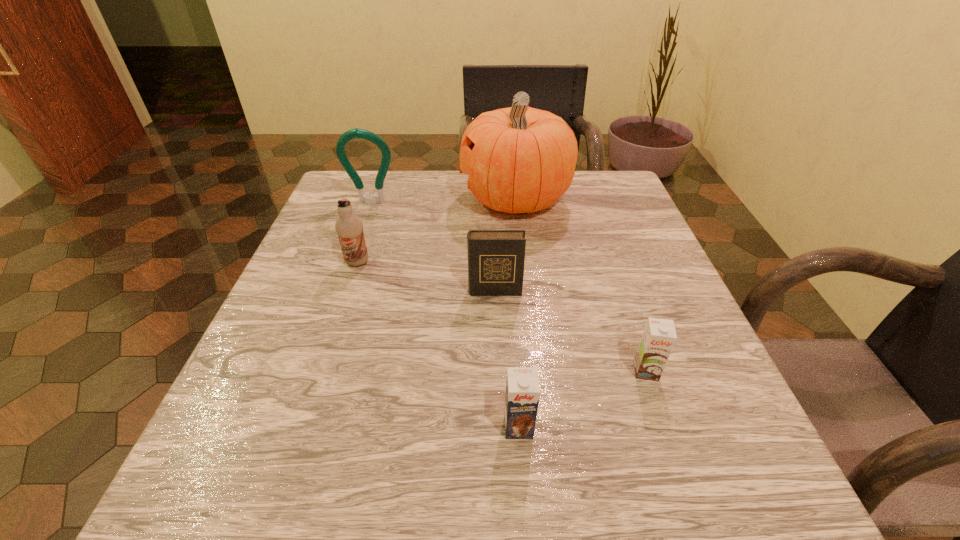
Find the location of a particular element. This screenshot has height=540, width=960. vacant space that's between the fifth farthest object and the pumpkin is located at coordinates (581, 285).

Where is `vacant area that lies between the farthest chocolate milk and the nearest object`? The width and height of the screenshot is (960, 540). vacant area that lies between the farthest chocolate milk and the nearest object is located at coordinates (438, 345).

Where is `vacant area that lies between the diary and the nearest chocolate milk`? This screenshot has width=960, height=540. vacant area that lies between the diary and the nearest chocolate milk is located at coordinates (507, 359).

Locate an element on the screen. Image resolution: width=960 pixels, height=540 pixels. empty space that is in between the nearest chocolate milk and the third nearest object is located at coordinates (507, 359).

Identify the location of vacant point located between the rightmost chocolate milk and the leftmost chocolate milk. Image resolution: width=960 pixels, height=540 pixels. (502, 316).

Identify the location of free space between the rightmost object and the tallest object. (581, 285).

The width and height of the screenshot is (960, 540). Find the location of `vacant region between the third nearest object and the bottle opener`. vacant region between the third nearest object and the bottle opener is located at coordinates (433, 247).

I want to click on free space between the rightmost chocolate milk and the fourth farthest object, so click(x=570, y=331).

The image size is (960, 540). What are the coordinates of `empty space that is in between the fourth farthest object and the second tallest object` in the screenshot? It's located at (433, 247).

The image size is (960, 540). I want to click on the closest object to the nearest chocolate milk, so click(x=659, y=336).